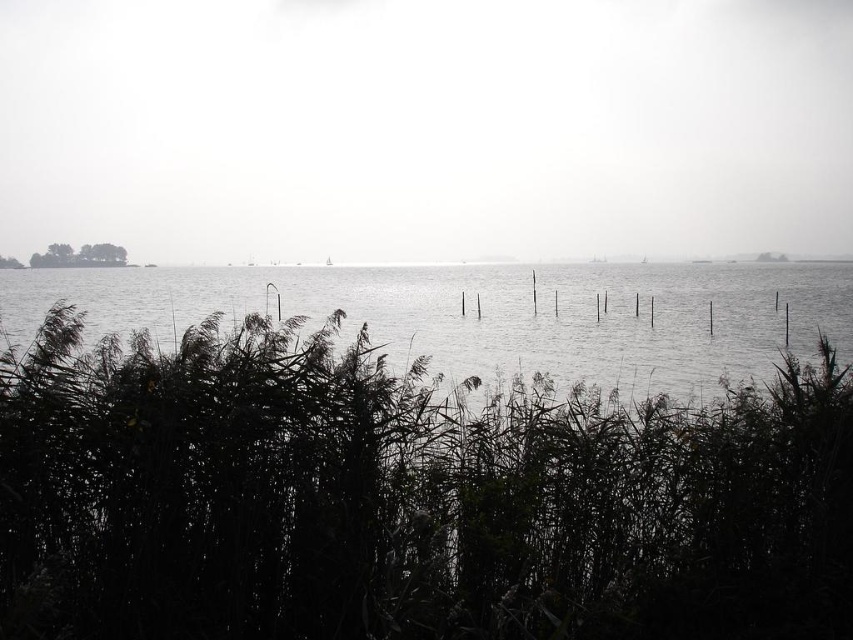
Looking at this image, you are a photographer standing at the lakeside. You want to capture a photo that includes both the dark green grass at lower center and the transparent water at center. Based on their positions, which object will appear closer to the camera in the final photo?

The dark green grass at lower center will appear closer to the camera in the final photo because it is positioned in front of the transparent water at center.

You are a fisherman who wants to cast your line into the lake. You notice two areas of water at the center of the image. Which area, the transparent water at center or the clear water at center, is closer to the surface where you can cast your line?

The transparent water at center is above the clear water at center, so casting your line into the transparent water at center would target the surface area closer to you.

In the scene shown: You are standing at the lakeside and see two points marked in the image. The first point is located at coordinates point (74,552) and the second at point (544,243). Which point is closer to you?

Point (74,552) is in front of point (544,243), so it is closer to you.